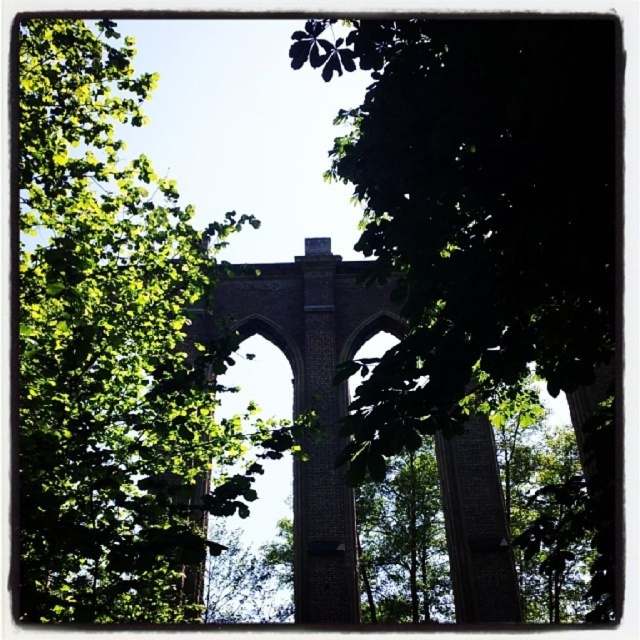
Between point (556, 365) and point (161, 602), which one is positioned behind?

Positioned behind is point (161, 602).

Describe the element at coordinates (486, 243) in the screenshot. I see `green leafy tree at center` at that location.

Is point (465, 186) closer to camera compared to point (20, 484)?

No, (465, 186) is behind (20, 484).

Where is `green leafy tree at center`? This screenshot has height=640, width=640. green leafy tree at center is located at coordinates (486, 243).